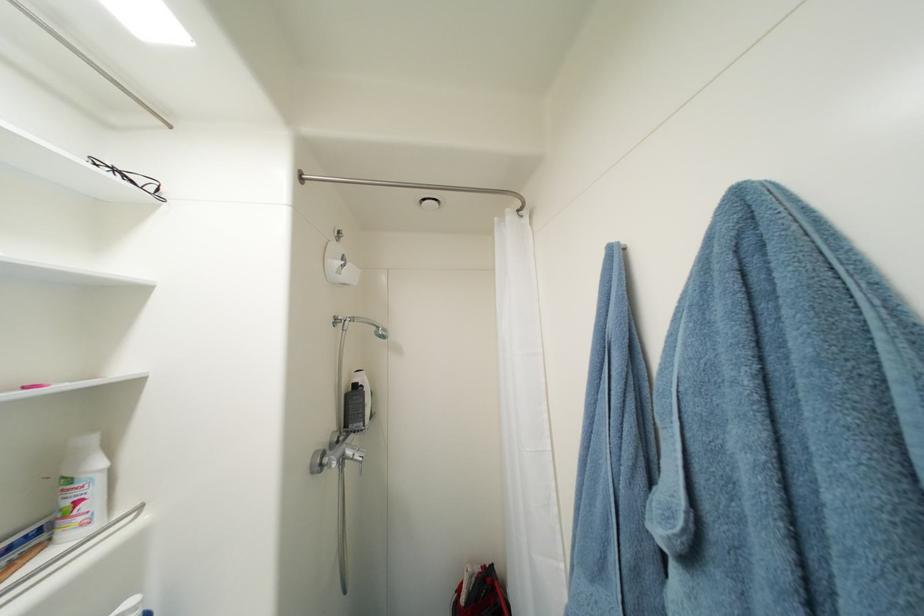
Where would you grasp the black eyeglasses? Please return your answer as a coordinate pair (x, y).

(130, 177)